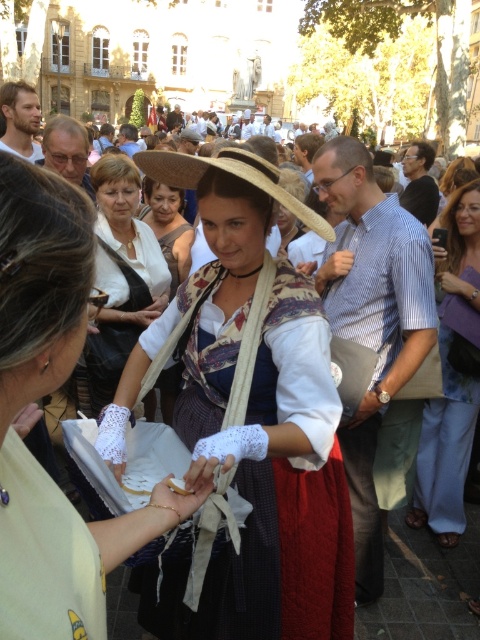
Question: Among these points, which one is farthest from the camera?

Choices:
 (A) coord(228,595)
 (B) coord(154,157)
 (C) coord(24,515)
 (D) coord(466,401)

Answer: (D)

Question: Is blue denim pants at lower right closer to camera compared to straw hat at center?

Choices:
 (A) no
 (B) yes

Answer: (A)

Question: Which object appears farthest from the camera in this image?

Choices:
 (A) matte white blouse at center
 (B) blue denim pants at lower right
 (C) matte white lace gloves at center
 (D) matte straw hat at center

Answer: (A)

Question: Is the position of matte white lace gloves at center less distant than that of blue denim pants at lower right?

Choices:
 (A) no
 (B) yes

Answer: (B)

Question: Does matte white lace gloves at center lie in front of blue denim pants at lower right?

Choices:
 (A) no
 (B) yes

Answer: (B)

Question: Among these objects, which one is nearest to the camera?

Choices:
 (A) matte straw hat at center
 (B) straw hat at center

Answer: (A)